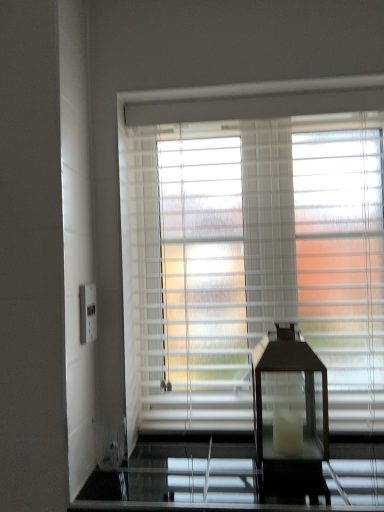
Question: Is black glass table lamp at center oriented away from white plastic electric outlet at left?

Choices:
 (A) yes
 (B) no

Answer: (B)

Question: Would you consider black glass table lamp at center to be distant from white plastic electric outlet at left?

Choices:
 (A) no
 (B) yes

Answer: (A)

Question: Can you confirm if black glass table lamp at center is positioned to the left of white plastic electric outlet at left?

Choices:
 (A) yes
 (B) no

Answer: (B)

Question: Can you confirm if black glass table lamp at center is taller than white plastic electric outlet at left?

Choices:
 (A) yes
 (B) no

Answer: (A)

Question: Does black glass table lamp at center have a lesser height compared to white plastic electric outlet at left?

Choices:
 (A) no
 (B) yes

Answer: (A)

Question: Is white textured blinds at center wider or thinner than white plastic electric outlet at left?

Choices:
 (A) thin
 (B) wide

Answer: (B)

Question: From a real-world perspective, is white textured blinds at center above or below white plastic electric outlet at left?

Choices:
 (A) below
 (B) above

Answer: (B)

Question: Based on their sizes in the image, would you say white textured blinds at center is bigger or smaller than white plastic electric outlet at left?

Choices:
 (A) small
 (B) big

Answer: (B)

Question: Is point (160, 392) closer or farther from the camera than point (89, 330)?

Choices:
 (A) farther
 (B) closer

Answer: (A)

Question: Looking at the image, does black glass table lamp at center seem bigger or smaller compared to white plastic electric outlet at left?

Choices:
 (A) big
 (B) small

Answer: (A)

Question: From a real-world perspective, is black glass table lamp at center positioned above or below white plastic electric outlet at left?

Choices:
 (A) above
 (B) below

Answer: (B)

Question: In the image, is black glass table lamp at center positioned in front of or behind white plastic electric outlet at left?

Choices:
 (A) behind
 (B) front

Answer: (B)

Question: Is point click(x=322, y=385) closer or farther from the camera than point click(x=94, y=306)?

Choices:
 (A) farther
 (B) closer

Answer: (B)

Question: Considering the positions of white plastic electric outlet at left and white textured blinds at center in the image, is white plastic electric outlet at left bigger or smaller than white textured blinds at center?

Choices:
 (A) small
 (B) big

Answer: (A)

Question: Is white plastic electric outlet at left in front of or behind white textured blinds at center in the image?

Choices:
 (A) behind
 (B) front

Answer: (B)